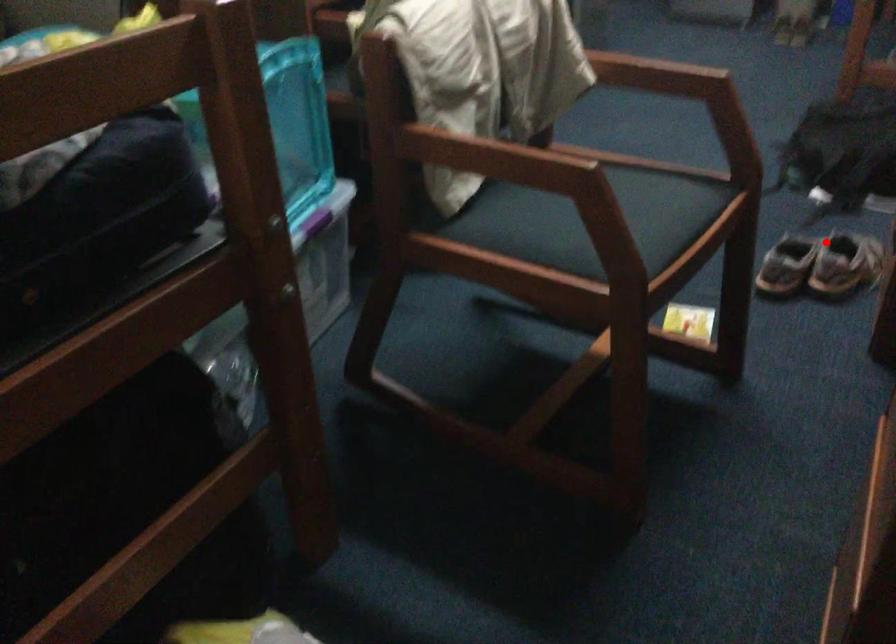
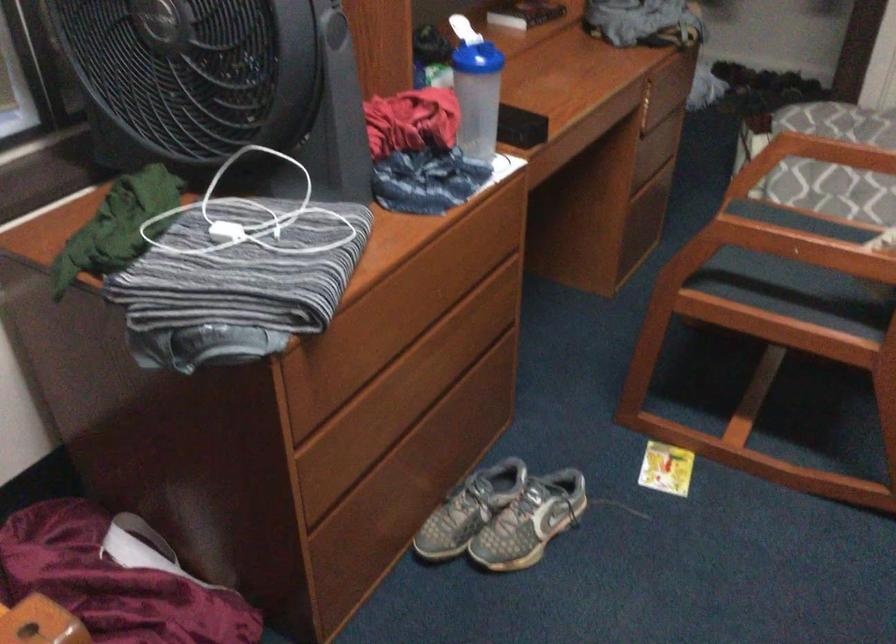
Question: I am providing you with two images of the same scene from different viewpoints. Image1 has a red point marked. In image2, the corresponding 3D location appears at what relative position? Reply with the corresponding letter.

Choices:
 (A) Closer
 (B) Farther

Answer: (A)